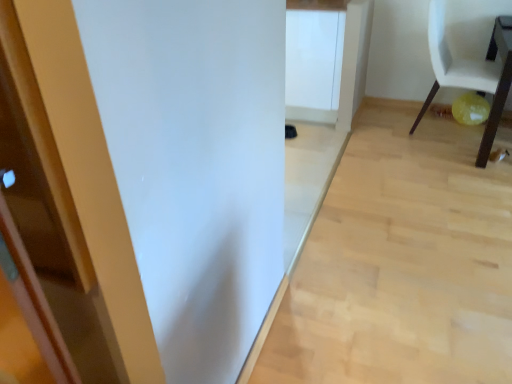
Image resolution: width=512 pixels, height=384 pixels. In order to click on white matte cabinet at center in this screenshot , I will do `click(313, 64)`.

Locate an element on the screen. light wood floor at center is located at coordinates (402, 263).

The width and height of the screenshot is (512, 384). In order to click on wooden table at lower right in this screenshot , I will do `click(498, 83)`.

Identify the location of white matte chair at right. Image resolution: width=512 pixels, height=384 pixels. (472, 71).

Find the location of a particular element. This screenshot has width=512, height=384. white matte cabinet at center is located at coordinates (313, 64).

How distant is white matte cabinet at center from wooden table at lower right?

white matte cabinet at center and wooden table at lower right are 1.22 meters apart.

From a real-world perspective, which is physically below, white matte cabinet at center or wooden table at lower right?

wooden table at lower right.

Is white matte cabinet at center wider than wooden table at lower right?

Incorrect, the width of white matte cabinet at center does not surpass that of wooden table at lower right.

From the image's perspective, which is above, white matte cabinet at center or wooden table at lower right?

white matte cabinet at center, from the image's perspective.

Where is `plain that appears below the white matte chair at right (from a real-world perspective)`? This screenshot has height=384, width=512. plain that appears below the white matte chair at right (from a real-world perspective) is located at coordinates (402, 263).

Based on their sizes in the image, would you say white matte chair at right is bigger or smaller than light wood floor at center?

white matte chair at right is bigger than light wood floor at center.

Between white matte chair at right and light wood floor at center, which one has smaller width?

white matte chair at right is thinner.

From a real-world perspective, is white matte chair at right above or below light wood floor at center?

white matte chair at right is above light wood floor at center.

Between wooden table at lower right and white matte chair at right, which one has less height?

Standing shorter between the two is wooden table at lower right.

Is white matte chair at right a part of wooden table at lower right?

No, white matte chair at right is not surrounded by wooden table at lower right.

At what (x,y) coordinates should I click in order to perform the action: click on table below the white matte chair at right (from the image's perspective). Please return your answer as a coordinate pair (x, y). The width and height of the screenshot is (512, 384). Looking at the image, I should click on (498, 83).

Between wooden table at lower right and white matte chair at right, which one has smaller width?

white matte chair at right is thinner.

Would you consider light wood floor at center to be distant from wooden table at lower right?

light wood floor at center is near wooden table at lower right, not far away.

Based on the photo, looking at their sizes, would you say light wood floor at center is wider or thinner than wooden table at lower right?

In the image, light wood floor at center appears to be wider than wooden table at lower right.

Is light wood floor at center bigger than wooden table at lower right?

No, light wood floor at center is not bigger than wooden table at lower right.

How different are the orientations of wooden table at lower right and white matte cabinet at center in degrees?

The angular difference between wooden table at lower right and white matte cabinet at center is 0.398 degrees.

Is wooden table at lower right positioned with its back to white matte cabinet at center?

wooden table at lower right is not turned away from white matte cabinet at center.

From the image's perspective, between wooden table at lower right and white matte cabinet at center, who is located below?

wooden table at lower right is shown below in the image.

Considering the sizes of objects white matte chair at right and white matte cabinet at center in the image provided, who is thinner, white matte chair at right or white matte cabinet at center?

white matte chair at right.

Does white matte chair at right come in front of white matte cabinet at center?

That is True.

Considering the sizes of white matte chair at right and white matte cabinet at center in the image, is white matte chair at right taller or shorter than white matte cabinet at center?

white matte chair at right is taller than white matte cabinet at center.

How much distance is there between white matte chair at right and white matte cabinet at center?

85.05 centimeters.

Identify the location of cabinetry positioned vertically above the light wood floor at center (from a real-world perspective). The width and height of the screenshot is (512, 384). (313, 64).

From the image's perspective, would you say white matte cabinet at center is positioned over light wood floor at center?

Yes.

Is white matte cabinet at center not within light wood floor at center?

That's correct, white matte cabinet at center is outside of light wood floor at center.

You are a GUI agent. You are given a task and a screenshot of the screen. Output one action in this format:
    pyautogui.click(x=<x>, y=<y>)
    Task: Click on the table on the right of white matte cabinet at center
    Image resolution: width=512 pixels, height=384 pixels.
    Given the screenshot: What is the action you would take?
    coord(498,83)

Locate an element on the screen. This screenshot has width=512, height=384. plain that appears on the left of white matte chair at right is located at coordinates (402, 263).

From the image, which object appears to be nearer to white matte cabinet at center, light wood floor at center or wooden table at lower right?

light wood floor at center lies closer to white matte cabinet at center than the other object.

From the image, which object appears to be farther from white matte chair at right, wooden table at lower right or light wood floor at center?

light wood floor at center is further to white matte chair at right.

From the image, which object appears to be farther from wooden table at lower right, white matte cabinet at center or white matte chair at right?

Based on the image, white matte cabinet at center appears to be further to wooden table at lower right.

Based on their spatial positions, is white matte cabinet at center or white matte chair at right further from light wood floor at center?

white matte cabinet at center is further to light wood floor at center.

Based on their spatial positions, is white matte cabinet at center or wooden table at lower right further from light wood floor at center?

white matte cabinet at center.

Based on their spatial positions, is white matte chair at right or wooden table at lower right closer to white matte cabinet at center?

white matte chair at right is positioned closer to the anchor white matte cabinet at center.

When comparing their distances from light wood floor at center, does wooden table at lower right or white matte chair at right seem further?

Based on the image, wooden table at lower right appears to be further to light wood floor at center.

Based on their spatial positions, is white matte chair at right or wooden table at lower right closer to light wood floor at center?

white matte chair at right lies closer to light wood floor at center than the other object.

I want to click on chair located between white matte cabinet at center and wooden table at lower right in the left-right direction, so click(472, 71).

Identify the location of table positioned between light wood floor at center and white matte cabinet at center from near to far. The width and height of the screenshot is (512, 384). (498, 83).

The width and height of the screenshot is (512, 384). I want to click on table located between light wood floor at center and white matte chair at right in the depth direction, so click(498, 83).

You are a GUI agent. You are given a task and a screenshot of the screen. Output one action in this format:
    pyautogui.click(x=<x>, y=<y>)
    Task: Click on the chair positioned between light wood floor at center and white matte cabinet at center from near to far
    This screenshot has width=512, height=384.
    Given the screenshot: What is the action you would take?
    pyautogui.click(x=472, y=71)